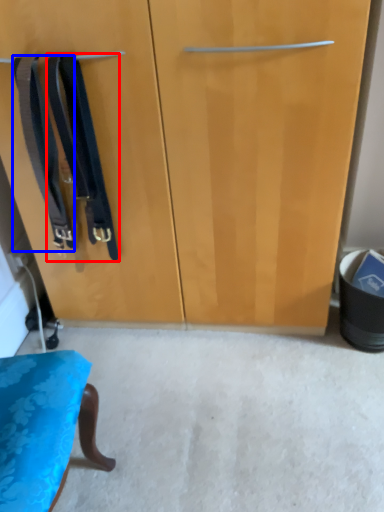
Question: Among these objects, which one is nearest to the camera, suspenders (highlighted by a red box) or suspenders (highlighted by a blue box)?

Choices:
 (A) suspenders
 (B) suspenders

Answer: (A)